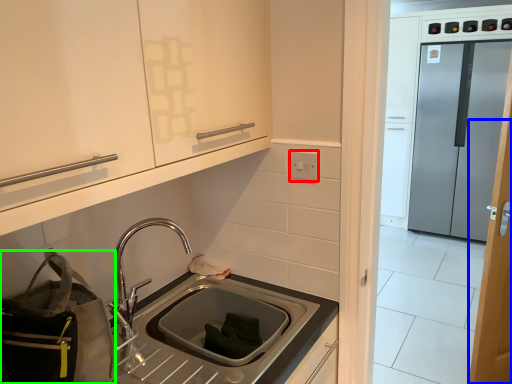
Question: Which object is the closest to the electric outlet (highlighted by a red box)? Choose among these: door (highlighted by a blue box) or bag (highlighted by a green box).

Choices:
 (A) door
 (B) bag

Answer: (B)